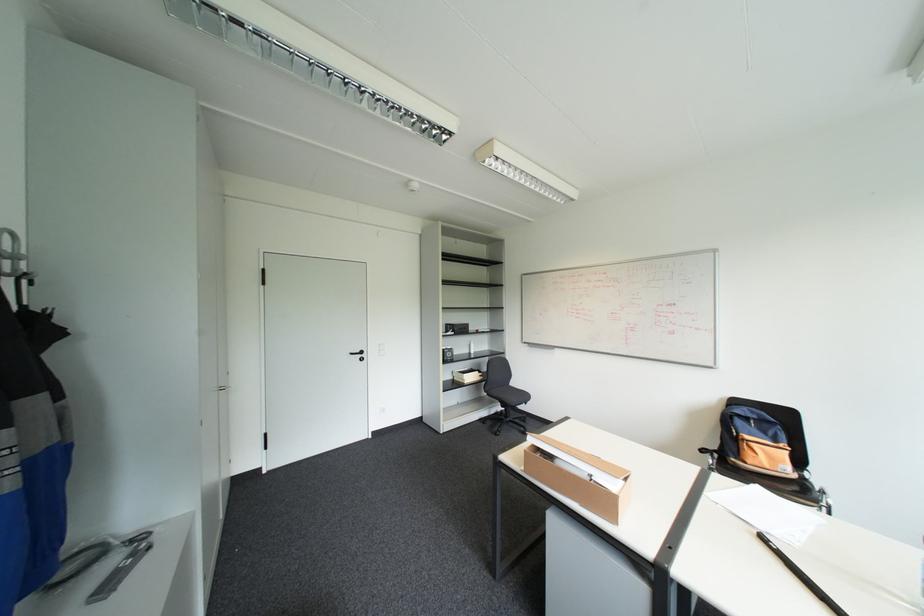
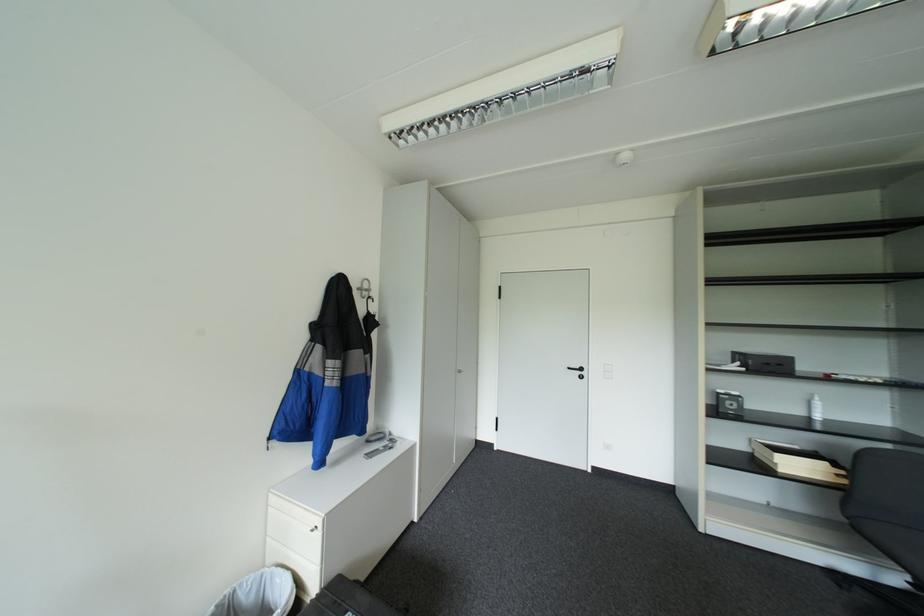
Question: The camera is either moving clockwise (left) or counter-clockwise (right) around the object. The first image is from the beginning of the video and the second image is from the end. Is the camera moving left or right when shooting the video?

Choices:
 (A) Left
 (B) Right

Answer: (B)